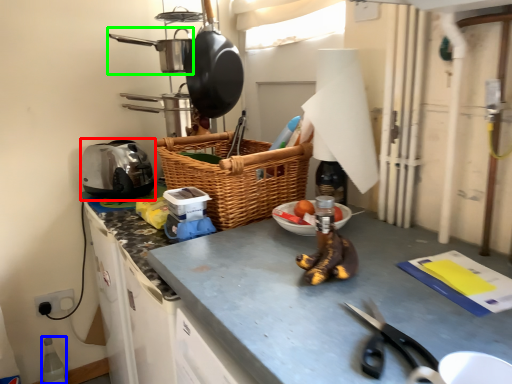
Question: Which is nearer to the appliance (highlighted by a red box)? bottle (highlighted by a blue box) or frying pan (highlighted by a green box).

Choices:
 (A) bottle
 (B) frying pan

Answer: (B)